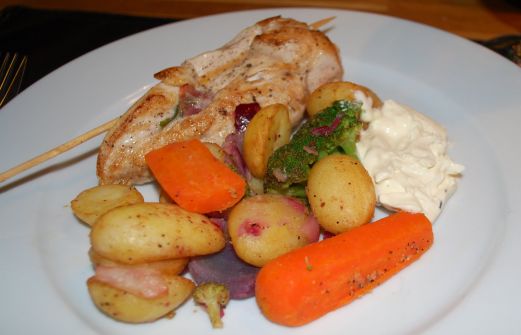
The width and height of the screenshot is (521, 335). Find the location of `table`. table is located at coordinates (442, 12).